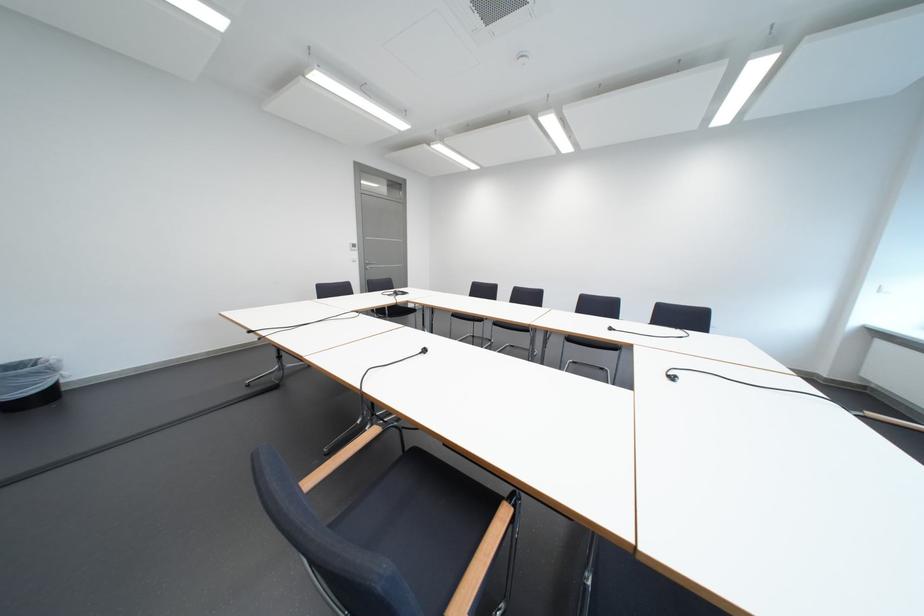
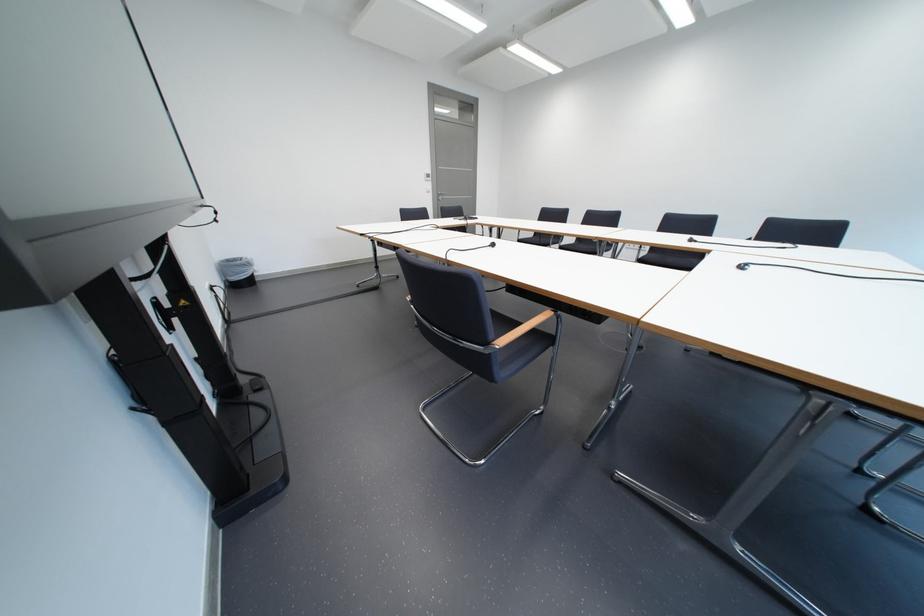
Question: In a continuous first-person perspective shot, in which direction is the camera moving?

Choices:
 (A) Left
 (B) Right
 (C) Forward
 (D) Backward

Answer: (D)